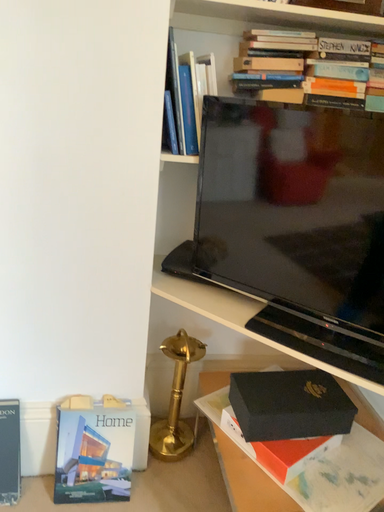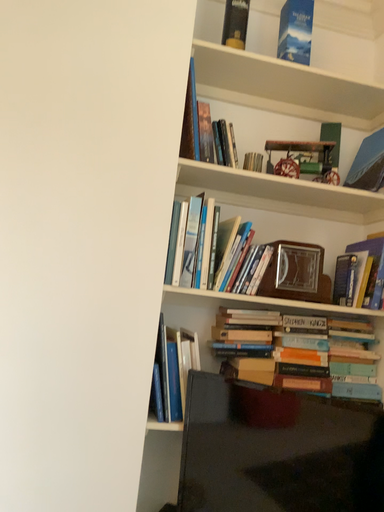
Question: How did the camera likely rotate when shooting the video?

Choices:
 (A) rotated downward
 (B) rotated upward

Answer: (B)